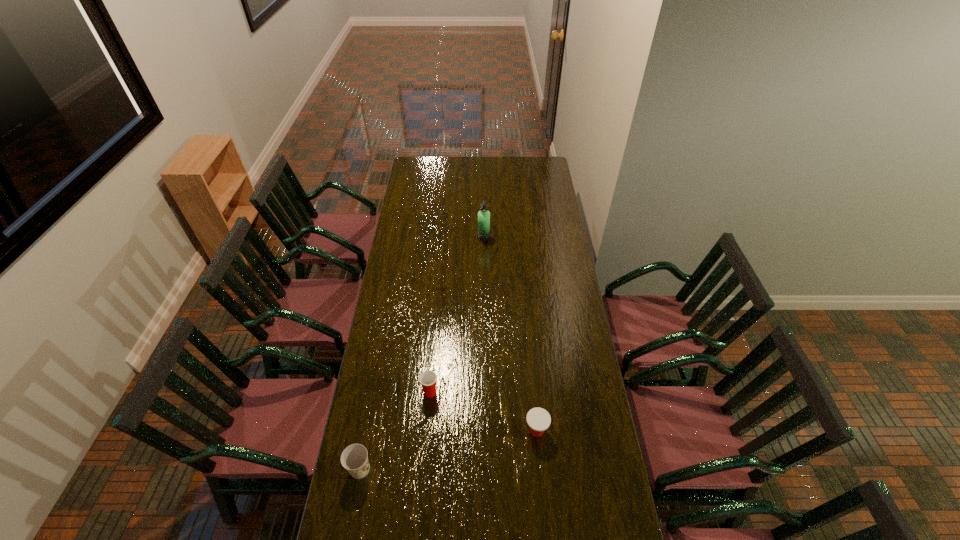
Find the location of `blank space located 0.090m on the back of the nearest object`. blank space located 0.090m on the back of the nearest object is located at coordinates (367, 432).

I want to click on vacant space located 0.190m on the front of the second nearest Dixie cup, so click(542, 497).

Locate an element on the screen. This screenshot has height=540, width=960. object at the left edge is located at coordinates (354, 458).

Locate an element on the screen. free space at the far edge of the desktop is located at coordinates (483, 160).

Identify the location of vacant space at the left edge of the desktop. This screenshot has height=540, width=960. (396, 304).

You are a GUI agent. You are given a task and a screenshot of the screen. Output one action in this format:
    pyautogui.click(x=<x>, y=<y>)
    Task: Click on the vacant space at the right edge of the desktop
    This screenshot has width=960, height=540.
    Given the screenshot: What is the action you would take?
    pyautogui.click(x=540, y=222)

What are the coordinates of `vacant space at the far left corner of the desktop` in the screenshot? It's located at [x=435, y=159].

This screenshot has height=540, width=960. Find the location of `empty space between the leftmost object and the rightmost object`. empty space between the leftmost object and the rightmost object is located at coordinates click(448, 450).

This screenshot has width=960, height=540. I want to click on free space between the leftmost object and the farthest object, so (x=422, y=353).

In order to click on free spot between the farthest object and the nearest object in this screenshot , I will do `click(422, 353)`.